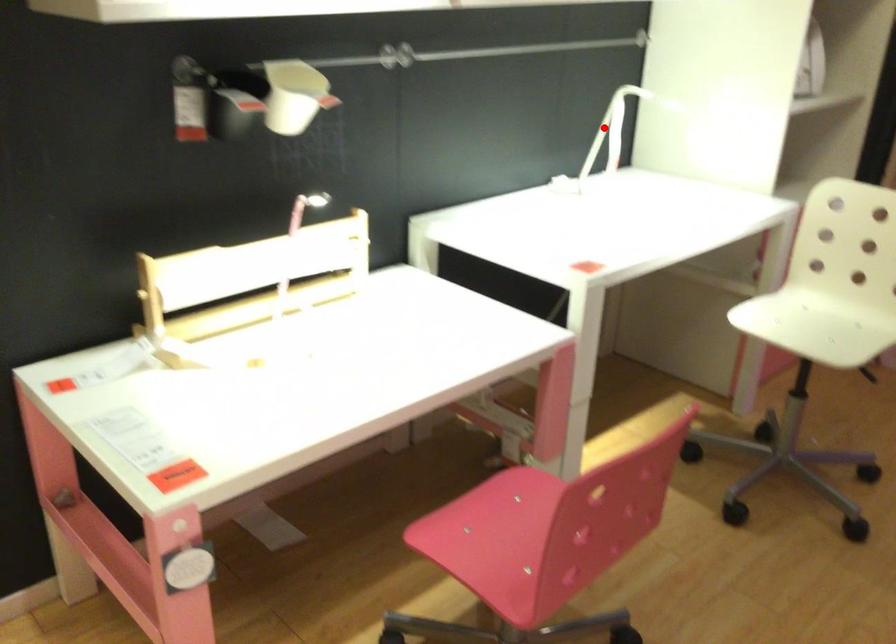
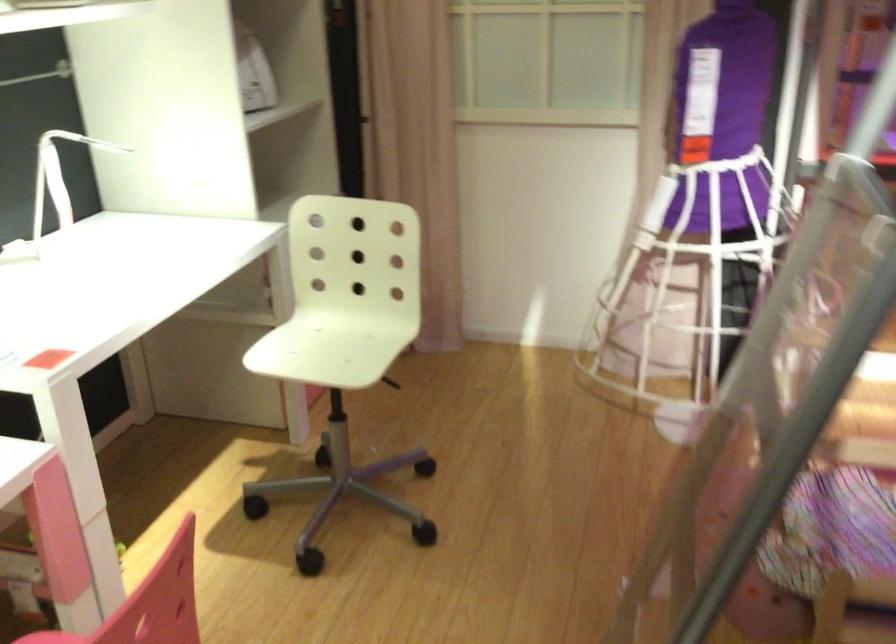
Find the pixel in the second image that matches the highlighted location in the first image.

(58, 176)